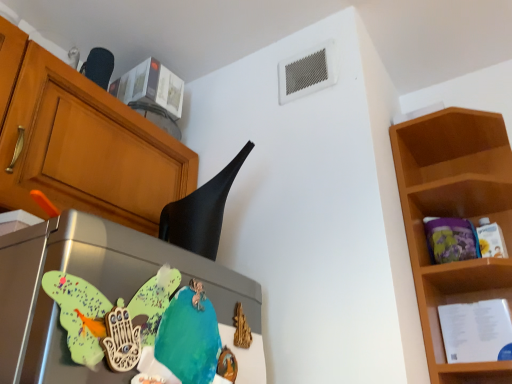
Question: Is black matte exhaust hood at upper center outside wooden shelf at right?

Choices:
 (A) yes
 (B) no

Answer: (A)

Question: Are black matte exhaust hood at upper center and wooden shelf at right located far from each other?

Choices:
 (A) yes
 (B) no

Answer: (B)

Question: Is the position of black matte exhaust hood at upper center more distant than that of wooden shelf at right?

Choices:
 (A) no
 (B) yes

Answer: (A)

Question: Is black matte exhaust hood at upper center surrounding wooden shelf at right?

Choices:
 (A) no
 (B) yes

Answer: (A)

Question: Considering the relative sizes of black matte exhaust hood at upper center and wooden shelf at right in the image provided, is black matte exhaust hood at upper center wider than wooden shelf at right?

Choices:
 (A) no
 (B) yes

Answer: (A)

Question: Is wooden shelf at right bigger or smaller than metallic refrigerator at center-left?

Choices:
 (A) big
 (B) small

Answer: (A)

Question: From the image's perspective, is wooden shelf at right positioned above or below metallic refrigerator at center-left?

Choices:
 (A) above
 (B) below

Answer: (B)

Question: Considering the positions of wooden shelf at right and metallic refrigerator at center-left in the image, is wooden shelf at right taller or shorter than metallic refrigerator at center-left?

Choices:
 (A) short
 (B) tall

Answer: (B)

Question: In the image, is wooden shelf at right positioned in front of or behind metallic refrigerator at center-left?

Choices:
 (A) front
 (B) behind

Answer: (B)

Question: From a real-world perspective, relative to black matte exhaust hood at upper center, is wooden shelf at right vertically above or below?

Choices:
 (A) below
 (B) above

Answer: (A)

Question: Considering the positions of wooden shelf at right and black matte exhaust hood at upper center in the image, is wooden shelf at right taller or shorter than black matte exhaust hood at upper center?

Choices:
 (A) tall
 (B) short

Answer: (A)

Question: Considering the positions of wooden shelf at right and black matte exhaust hood at upper center in the image, is wooden shelf at right wider or thinner than black matte exhaust hood at upper center?

Choices:
 (A) thin
 (B) wide

Answer: (B)

Question: In the image, is wooden shelf at right positioned in front of or behind black matte exhaust hood at upper center?

Choices:
 (A) behind
 (B) front

Answer: (A)

Question: Would you say black matte exhaust hood at upper center is to the left or to the right of metallic refrigerator at center-left in the picture?

Choices:
 (A) left
 (B) right

Answer: (B)

Question: Looking at their shapes, would you say black matte exhaust hood at upper center is wider or thinner than metallic refrigerator at center-left?

Choices:
 (A) wide
 (B) thin

Answer: (A)